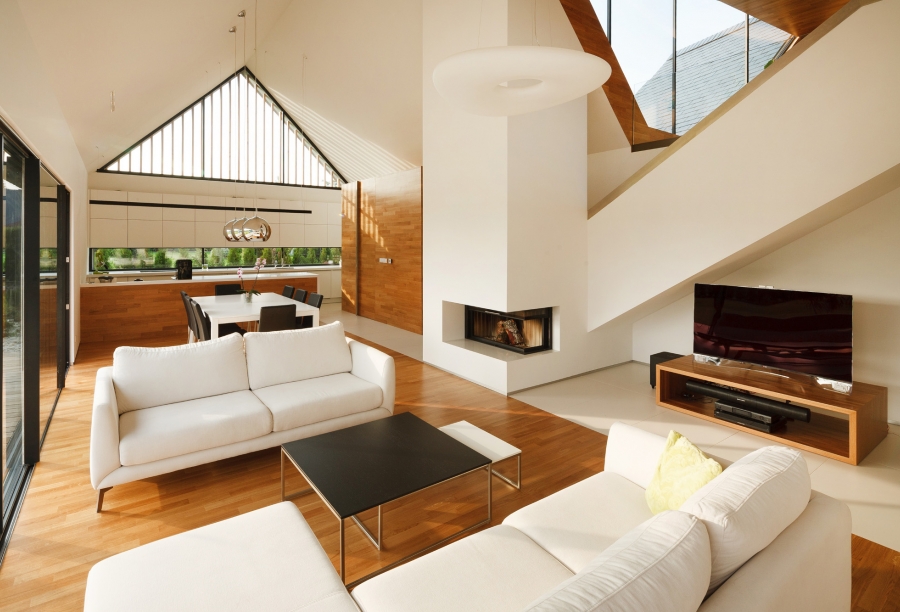
You are a GUI agent. You are given a task and a screenshot of the screen. Output one action in this format:
    pyautogui.click(x=<x>, y=<y>)
    Task: Click on the yellow pillow
    Image resolution: width=900 pixels, height=612 pixels.
    Given the screenshot: What is the action you would take?
    pyautogui.click(x=677, y=472)